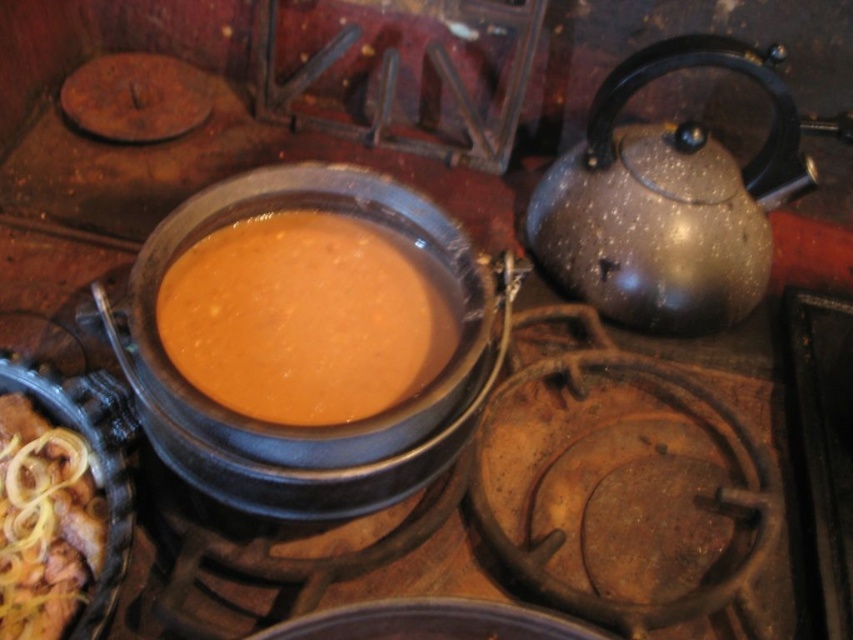
You are a chef preparing to serve tea and soup. You need to place both the shiny metallic teapot at right and the orange matte soup at center on a shelf that can only hold items up to 30 cm in height. Which item might exceed the shelf height limit?

The shiny metallic teapot at right is much taller than the orange matte soup at center, so it might exceed the shelf height limit.

You are a chef in a rustic kitchen and need to place the golden brown crispy onions at lower left closer to the stove. Which direction should you move them to ensure they are near the shiny metallic teapot at right?

The shiny metallic teapot at right is to the right of the golden brown crispy onions at lower left, so you should move the golden brown crispy onions at lower left to the right to be near the shiny metallic teapot at right.

You are a chef preparing a dish and need to check the height of the orange matte soup at center and the golden brown crispy onions at lower left. Which one is taller?

The orange matte soup at center is taller than the golden brown crispy onions at lower left.